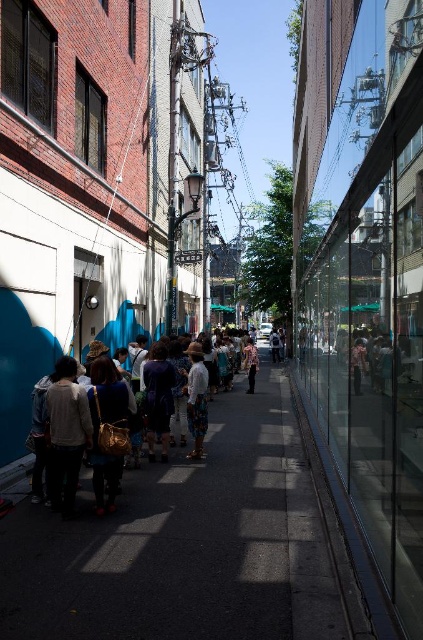
You are a delivery person carrying a box that is 1.5 meters long. You need to navigate through the narrow street scene described. Can you safely move the box along the dark gray concrete sidewalk at center while avoiding the dark gray sweater at center?

The distance between the dark gray concrete sidewalk at center and the dark gray sweater at center is 1.26 meters. Since the box is 1.5 meters long, it is longer than the available space between them, so you cannot safely move the box without risking collision with the dark gray sweater at center.

You are standing on the street and want to take a photo of the metallic wire at upper left without the dark gray concrete sidewalk at center appearing in the frame. Is this possible given their positions?

The dark gray concrete sidewalk at center is closer to the viewer than the metallic wire at upper left. To avoid the sidewalk in the photo, you would need to adjust your angle or position so that the sidewalk is not in the same line of sight as the metallic wire.

Looking at this image, you are standing at the entrance of a building and want to cross the street to reach the park on the other side. The dark gray concrete sidewalk at center is located at point 0.850, 0.442. Is the sidewalk at center in front of or behind you?

The dark gray concrete sidewalk at center is located at point (186, 544), which is in front of you as you stand at the entrance.